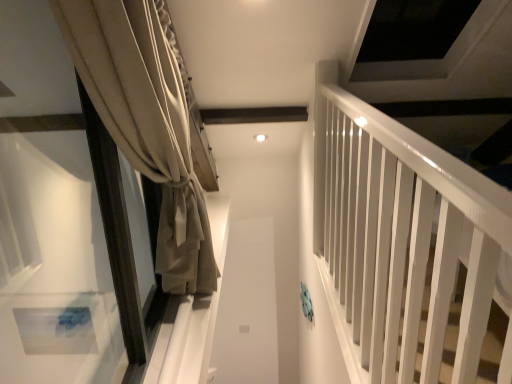
Measure the distance between white glossy rail at right and camera.

The distance of white glossy rail at right from camera is 23.18 inches.

The height and width of the screenshot is (384, 512). Find the location of `white glossy rail at right`. white glossy rail at right is located at coordinates (399, 240).

The width and height of the screenshot is (512, 384). What do you see at coordinates (399, 240) in the screenshot?
I see `white glossy rail at right` at bounding box center [399, 240].

Find the location of a particular element. beige fabric curtain at left is located at coordinates (145, 123).

What is the approximate width of beige fabric curtain at left?

It is 33.45 inches.

What do you see at coordinates (145, 123) in the screenshot?
I see `beige fabric curtain at left` at bounding box center [145, 123].

This screenshot has height=384, width=512. Find the location of `white glossy rail at right`. white glossy rail at right is located at coordinates (399, 240).

Which is more to the right, beige fabric curtain at left or white glossy rail at right?

Positioned to the right is white glossy rail at right.

Considering the positions of objects beige fabric curtain at left and white glossy rail at right in the image provided, who is in front, beige fabric curtain at left or white glossy rail at right?

Positioned in front is white glossy rail at right.

Which is in front, point (187, 194) or point (385, 187)?

The point (385, 187) is more forward.

From the image's perspective, is beige fabric curtain at left located above or below white glossy rail at right?

From the image's perspective, beige fabric curtain at left appears above white glossy rail at right.

From a real-world perspective, who is located higher, beige fabric curtain at left or white glossy rail at right?

beige fabric curtain at left.

Considering the sizes of beige fabric curtain at left and white glossy rail at right in the image, is beige fabric curtain at left wider or thinner than white glossy rail at right?

In the image, beige fabric curtain at left appears to be more narrow than white glossy rail at right.

Which of these two, beige fabric curtain at left or white glossy rail at right, stands taller?

With more height is beige fabric curtain at left.

Between beige fabric curtain at left and white glossy rail at right, which one has larger size?

Bigger between the two is white glossy rail at right.

Would you say beige fabric curtain at left is outside white glossy rail at right?

That's correct, beige fabric curtain at left is outside of white glossy rail at right.

Is beige fabric curtain at left not close to white glossy rail at right?

They are positioned close to each other.

Is beige fabric curtain at left looking in the opposite direction of white glossy rail at right?

No, white glossy rail at right is not at the back of beige fabric curtain at left.

In the scene shown: How different are the orientations of beige fabric curtain at left and white glossy rail at right in degrees?

They differ by 7.54 degrees in their facing directions.

Measure the distance from beige fabric curtain at left to white glossy rail at right.

beige fabric curtain at left and white glossy rail at right are 68.05 centimeters apart.

Image resolution: width=512 pixels, height=384 pixels. I want to click on curtain located behind the white glossy rail at right, so click(145, 123).

In the image, is white glossy rail at right on the left side or the right side of beige fabric curtain at left?

Clearly, white glossy rail at right is on the right of beige fabric curtain at left in the image.

Which object is closer to the camera taking this photo, white glossy rail at right or beige fabric curtain at left?

white glossy rail at right is closer to the camera.

Does point (447, 310) come behind point (170, 55)?

No.

From the image's perspective, does white glossy rail at right appear lower than beige fabric curtain at left?

Yes, from the image's perspective, white glossy rail at right is beneath beige fabric curtain at left.

From a real-world perspective, which object rests below the other?

white glossy rail at right is physically lower.

Is white glossy rail at right wider or thinner than beige fabric curtain at left?

Clearly, white glossy rail at right has more width compared to beige fabric curtain at left.

Between white glossy rail at right and beige fabric curtain at left, which one has less height?

white glossy rail at right is shorter.

Between white glossy rail at right and beige fabric curtain at left, which one has larger size?

white glossy rail at right.

Is beige fabric curtain at left surrounded by white glossy rail at right?

No, white glossy rail at right does not contain beige fabric curtain at left.

Is white glossy rail at right directly adjacent to beige fabric curtain at left?

No, white glossy rail at right is not in contact with beige fabric curtain at left.

Could you tell me if white glossy rail at right is facing beige fabric curtain at left?

No, white glossy rail at right is not oriented towards beige fabric curtain at left.

How far apart are white glossy rail at right and beige fabric curtain at left?

They are 68.05 centimeters apart.

This screenshot has width=512, height=384. I want to click on curtain above the white glossy rail at right (from the image's perspective), so click(145, 123).

Locate an element on the screen. This screenshot has height=384, width=512. curtain that appears behind the white glossy rail at right is located at coordinates (145, 123).

Where is `bunk bed below the beige fabric curtain at left (from the image's perspective)`? The height and width of the screenshot is (384, 512). bunk bed below the beige fabric curtain at left (from the image's perspective) is located at coordinates (399, 240).